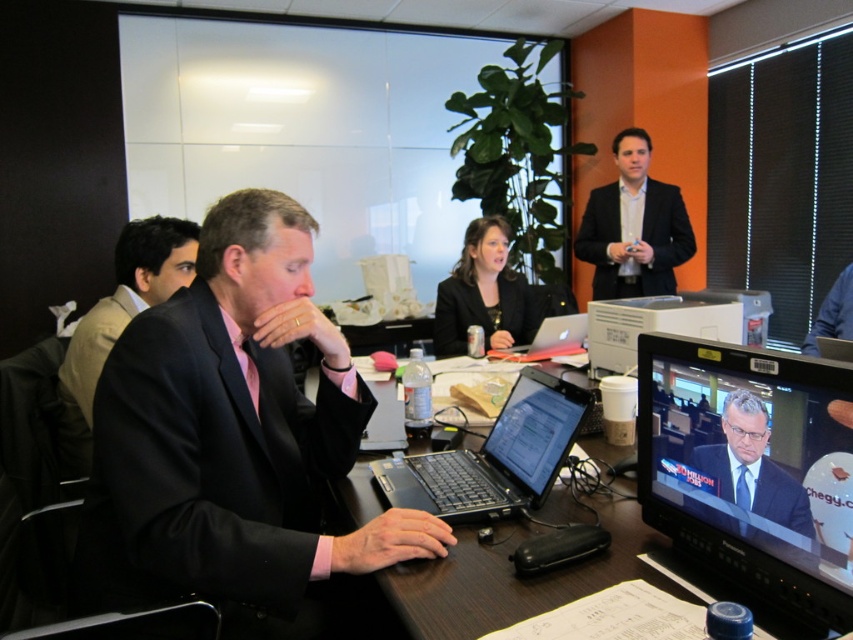
You are standing in the meeting room and want to move from the point closer to the entrance to the point near the presenter. Which direction should you move relative to the two points labeled as point (x=196, y=412) and point (x=519, y=508)?

Based on the coordinates provided, point (x=196, y=412) is in front of point (x=519, y=508). Therefore, to move from the entrance point to the presenter area, you should move towards point (x=196, y=412) as it is closer to the entrance and in front of the other point.